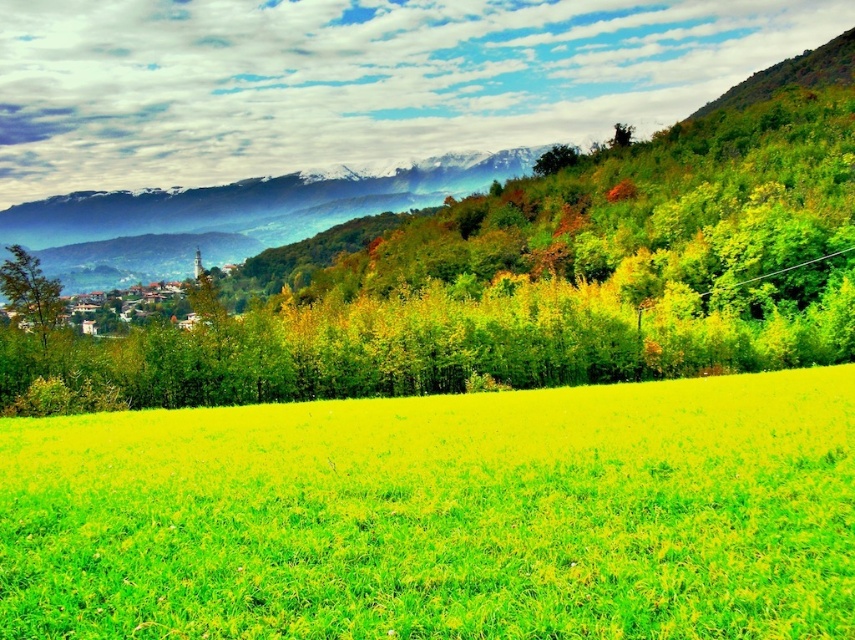
Question: Considering the relative positions of bright green grass at center and green matte tree at left in the image provided, where is bright green grass at center located with respect to green matte tree at left?

Choices:
 (A) below
 (B) above

Answer: (A)

Question: Does bright green grass at center appear over green matte tree at left?

Choices:
 (A) yes
 (B) no

Answer: (B)

Question: Which of the following is the farthest from the observer?

Choices:
 (A) green matte tree at left
 (B) bright green grass at center

Answer: (A)

Question: Which point is farther to the camera?

Choices:
 (A) (22, 314)
 (B) (208, 508)

Answer: (A)

Question: Can you confirm if bright green grass at center is bigger than green matte tree at left?

Choices:
 (A) yes
 (B) no

Answer: (B)

Question: Which of the following is the closest to the observer?

Choices:
 (A) bright green grass at center
 (B) green matte tree at left

Answer: (A)